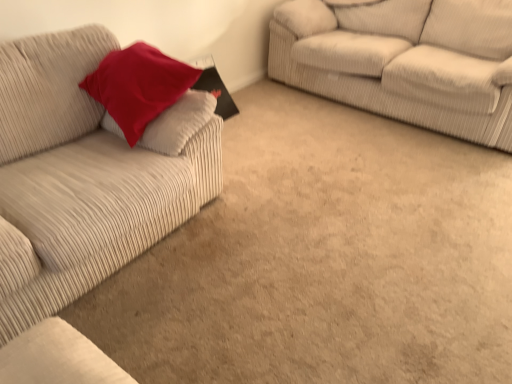
What do you see at coordinates (404, 61) in the screenshot? Image resolution: width=512 pixels, height=384 pixels. I see `beige corduroy couch at upper right` at bounding box center [404, 61].

Where is `beige corduroy couch at upper right`? beige corduroy couch at upper right is located at coordinates (404, 61).

Locate an element on the screen. beige corduroy couch at upper right is located at coordinates (404, 61).